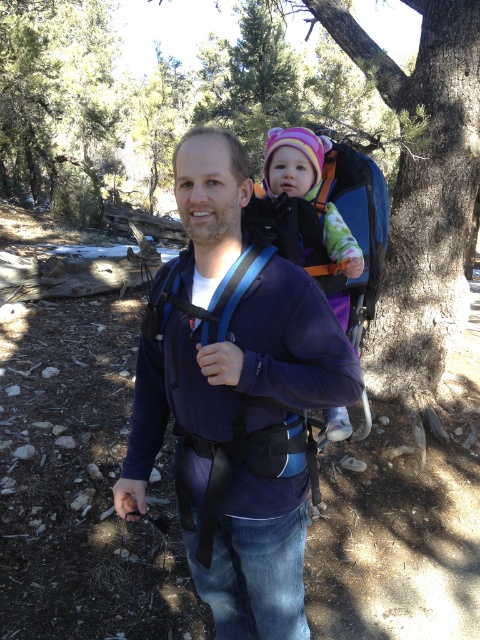
The width and height of the screenshot is (480, 640). What do you see at coordinates (235, 397) in the screenshot?
I see `blue fleece jacket at center` at bounding box center [235, 397].

Does blue fleece jacket at center have a smaller size compared to multicolored fleece hat at center?

No.

Is point (133, 396) closer to viewer compared to point (312, 186)?

That is False.

This screenshot has width=480, height=640. I want to click on blue fleece jacket at center, so click(x=235, y=397).

Is point (307, 353) more distant than point (73, 16)?

No, (307, 353) is closer to viewer.

Image resolution: width=480 pixels, height=640 pixels. Describe the element at coordinates (235, 397) in the screenshot. I see `blue fleece jacket at center` at that location.

At what (x,y) coordinates should I click in order to perform the action: click on blue fleece jacket at center. Please return your answer as a coordinate pair (x, y). This screenshot has height=640, width=480. Looking at the image, I should click on (235, 397).

Can you confirm if green leafy tree at upper left is positioned to the right of multicolored fleece hat at center?

In fact, green leafy tree at upper left is to the left of multicolored fleece hat at center.

Does green leafy tree at upper left appear on the left side of multicolored fleece hat at center?

Yes, green leafy tree at upper left is to the left of multicolored fleece hat at center.

Between point (91, 189) and point (330, 420), which one is positioned in front?

Point (330, 420)

Locate an element on the screen. The width and height of the screenshot is (480, 640). green leafy tree at upper left is located at coordinates (57, 104).